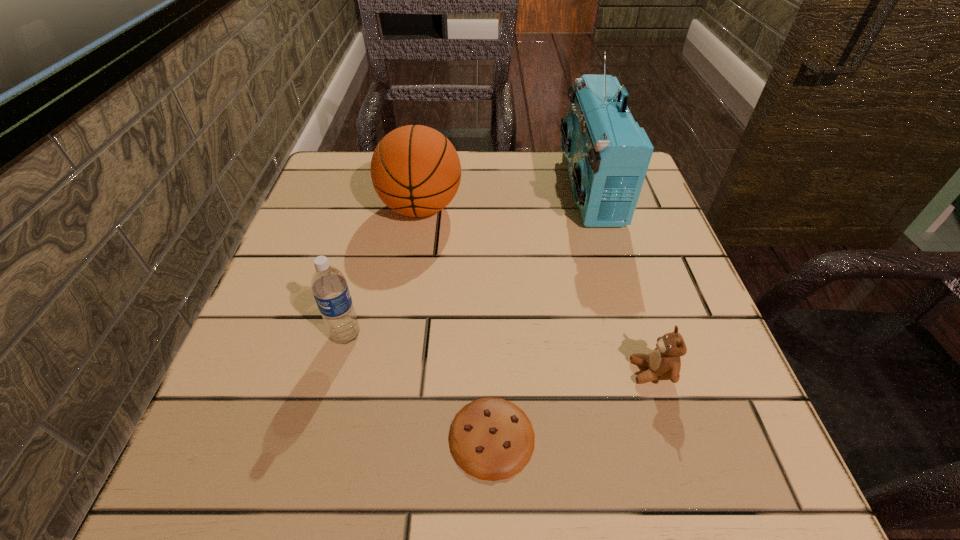
Locate an element on the screen. The image size is (960, 540). the tallest object is located at coordinates (608, 154).

Find the location of a particular element. This screenshot has height=540, width=960. basketball is located at coordinates (415, 170).

Where is `water bottle`? water bottle is located at coordinates (329, 287).

Where is `the fourth tallest object`? The width and height of the screenshot is (960, 540). the fourth tallest object is located at coordinates (664, 363).

This screenshot has height=540, width=960. Find the location of `teddy bear`. teddy bear is located at coordinates (664, 363).

Where is `the shortest object`? The height and width of the screenshot is (540, 960). the shortest object is located at coordinates (492, 439).

Find the location of a particular element. the nearest object is located at coordinates (492, 439).

Find the location of a particular element. vacant region located on the front-facing side of the tallest object is located at coordinates (517, 186).

Find the location of a particular element. Image resolution: width=960 pixels, height=540 pixels. vacant space located on the front-facing side of the tallest object is located at coordinates (458, 186).

This screenshot has width=960, height=540. What are the coordinates of `vacant space located 0.060m on the front-facing side of the tallest object` in the screenshot? It's located at (540, 186).